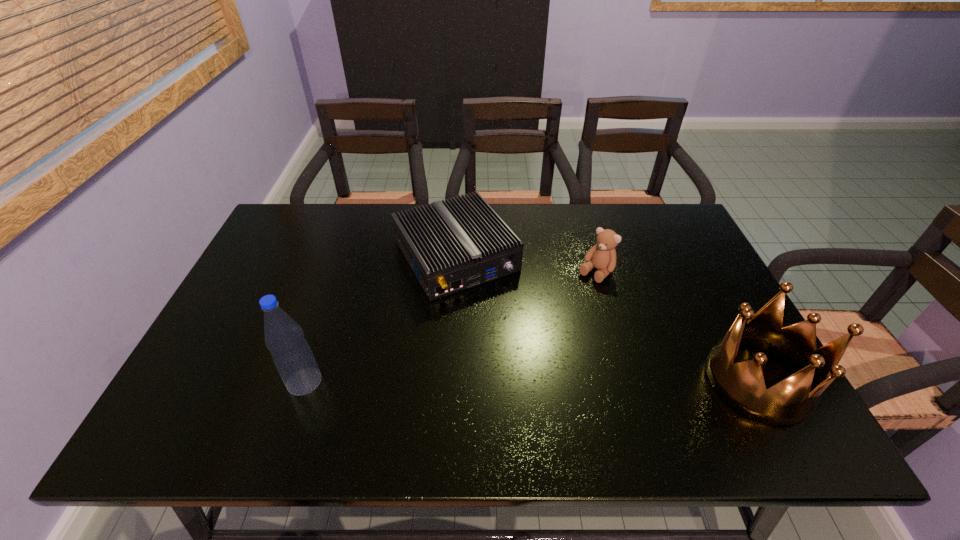
I want to click on unoccupied position between the water bottle and the router, so click(380, 319).

Where is `empty location between the crown and the leftmost object`? The height and width of the screenshot is (540, 960). empty location between the crown and the leftmost object is located at coordinates pos(531,381).

Identify the location of free space that is in between the leftmost object and the third shortest object. (531, 381).

Locate an element on the screen. The width and height of the screenshot is (960, 540). unoccupied area between the shortest object and the water bottle is located at coordinates (380, 319).

At what (x,y) coordinates should I click in order to perform the action: click on blank region between the teddy bear and the shortest object. Please return your answer as a coordinate pair (x, y). The width and height of the screenshot is (960, 540). Looking at the image, I should click on (526, 265).

Where is `free space between the rightmost object and the third object from left to right`? free space between the rightmost object and the third object from left to right is located at coordinates (677, 326).

You are a GUI agent. You are given a task and a screenshot of the screen. Output one action in this format:
    pyautogui.click(x=<x>, y=<y>)
    Task: Click on the free space between the crown and the second shortest object
    This screenshot has height=540, width=960.
    Given the screenshot: What is the action you would take?
    pyautogui.click(x=677, y=326)

Locate an element on the screen. object identified as the closest to the shortest object is located at coordinates (602, 256).

Point out which object is positioned as the nearest to the second tallest object. Please provide its 2D coordinates. Your answer should be formatted as a tuple, i.e. [(x, y)], where the tuple contains the x and y coordinates of a point satisfying the conditions above.

[(602, 256)]

Where is `free location that satisfies the following two spatial constraints: 1. on the back side of the tallest object; 2. on the left side of the shortest object`? This screenshot has height=540, width=960. free location that satisfies the following two spatial constraints: 1. on the back side of the tallest object; 2. on the left side of the shortest object is located at coordinates (347, 256).